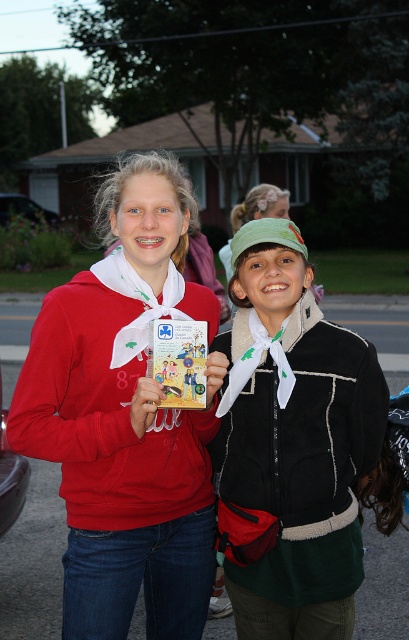
Question: Is matte red sweatshirt at center in front of black fleece jacket at center?

Choices:
 (A) yes
 (B) no

Answer: (A)

Question: Which of these objects is positioned farthest from the black fleece jacket at center?

Choices:
 (A) matte paper comic book at center
 (B) matte red sweatshirt at center

Answer: (B)

Question: Which point is closer to the camera taking this photo?

Choices:
 (A) (263, 636)
 (B) (175, 387)
 (C) (125, 394)

Answer: (B)

Question: Is black fleece jacket at center bigger than matte paper comic book at center?

Choices:
 (A) yes
 (B) no

Answer: (A)

Question: Does black fleece jacket at center appear on the left side of matte paper comic book at center?

Choices:
 (A) yes
 (B) no

Answer: (B)

Question: Among these points, which one is farthest from the camera?

Choices:
 (A) click(x=204, y=358)
 (B) click(x=368, y=428)
 (C) click(x=159, y=243)

Answer: (B)